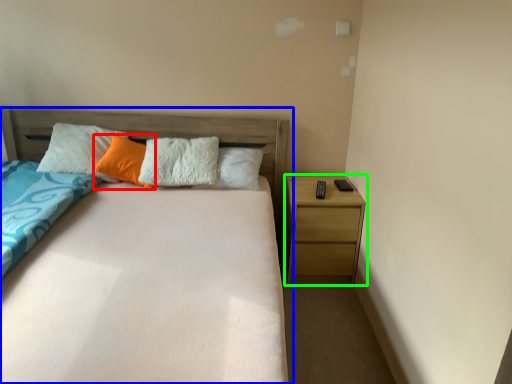
Question: Which is nearer to the pillow (highlighted by a red box)? bed (highlighted by a blue box) or nightstand (highlighted by a green box).

Choices:
 (A) bed
 (B) nightstand

Answer: (A)